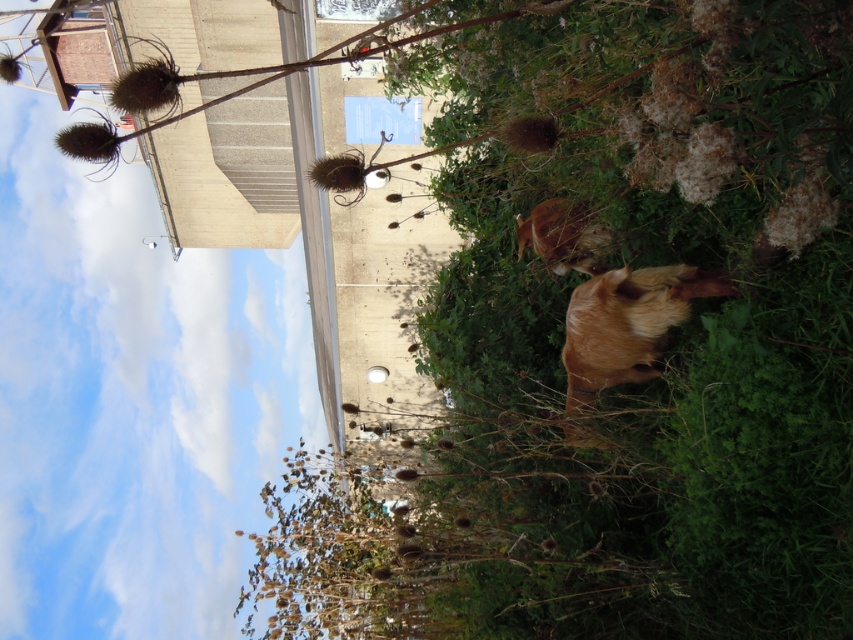
You are standing in the outdoor scene described. You see a golden fur goat at center and a brown furry dog at center. Which animal is positioned to the right of the other?

The golden fur goat at center is to the right of the brown furry dog at center.

You are standing at the point marked as point (630, 358) in the image. What do you see directly in front of you?

You see a brown fuzzy plant at center directly in front of you at point (630, 358).